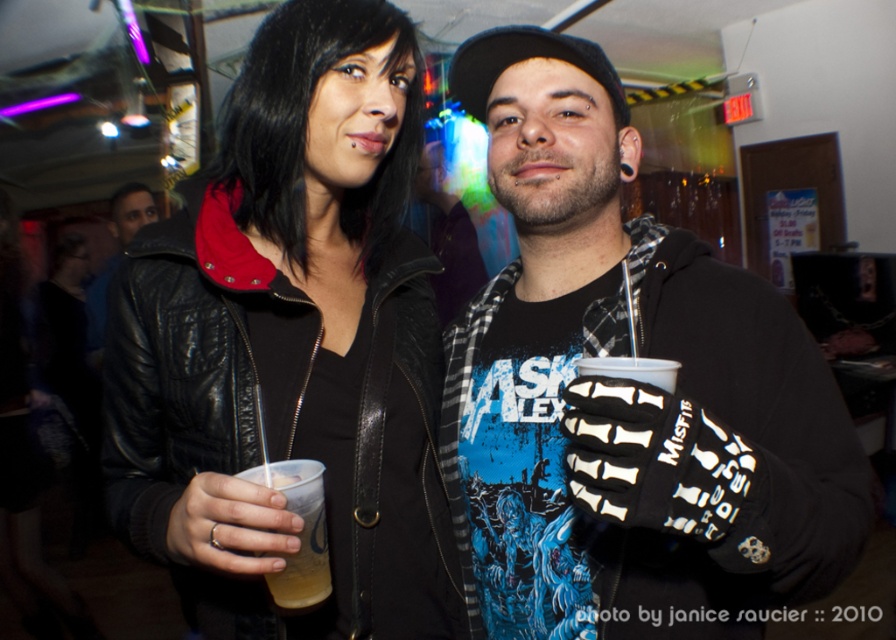
You are organizing a costume party and need to decide whether to place the black matte glove at center and the matte black leather jacket at center into a display case. The case has a width of 1 meter. Can both items fit side by side without overlapping?

The black matte glove at center occupies less space than the matte black leather jacket at center. Since the display case is 1 meter wide, both items can fit side by side as their combined space requirements are likely within the 1 meter width.

You are a photographer standing at the event and want to take a closeup shot of the black matte glove at center without including the people around it. Given that your camera has a depth of field that can focus clearly on objects within a 40 cm range from the focal point, can you achieve this shot?

The black matte glove at center is 45.90 centimeters away from the camera. Since the depth of field can focus within 40 cm, the glove is slightly beyond the optimal range. To capture it clearly, adjust focus or move closer to ensure it falls within the 40 cm threshold.

You are at a party and see the black matte glove at center. Where exactly is it located in the room?

The black matte glove at center is located at point 0.614 on the x axis and 0.701 on the y axis.